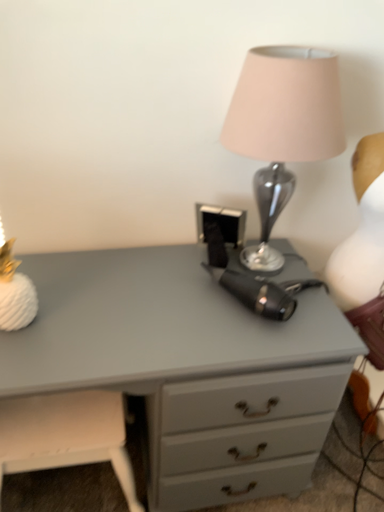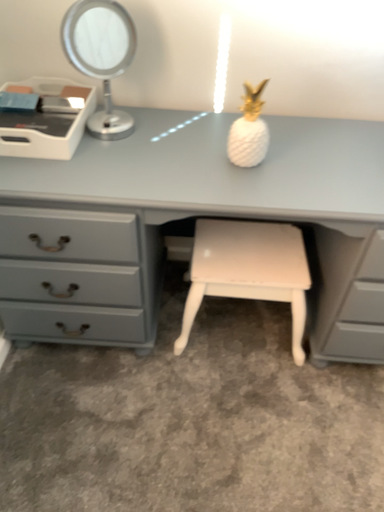
Question: Which way did the camera rotate in the video?

Choices:
 (A) rotated right
 (B) rotated left

Answer: (B)